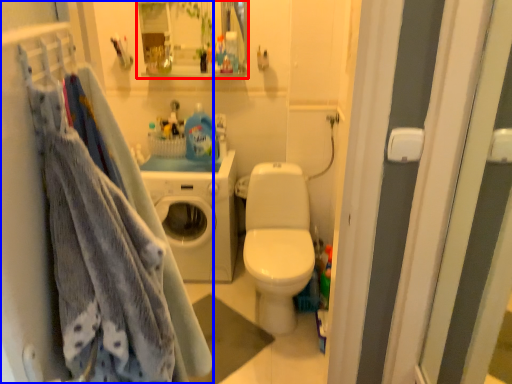
Question: Which point is further to the camera, cabinet (highlighted by a red box) or closet (highlighted by a blue box)?

Choices:
 (A) cabinet
 (B) closet

Answer: (A)